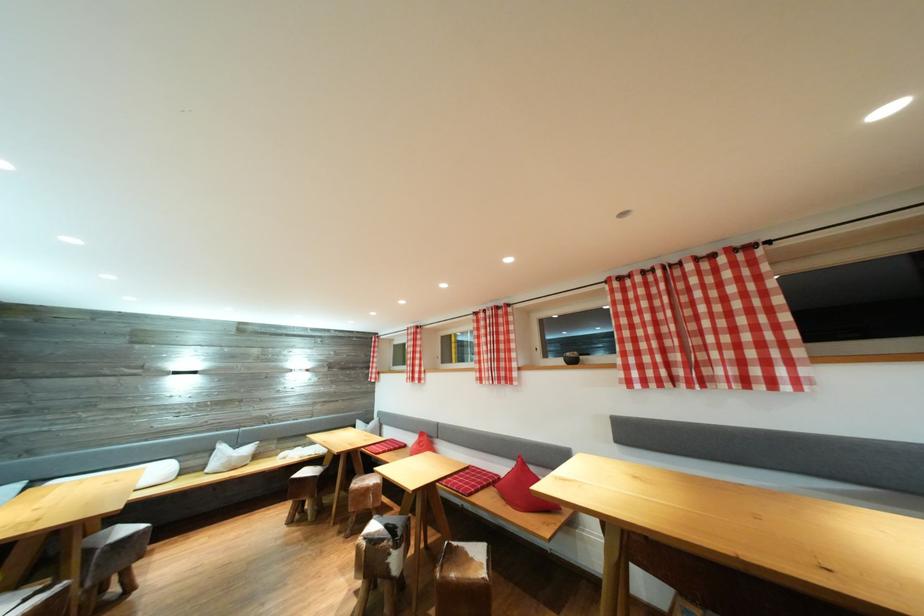
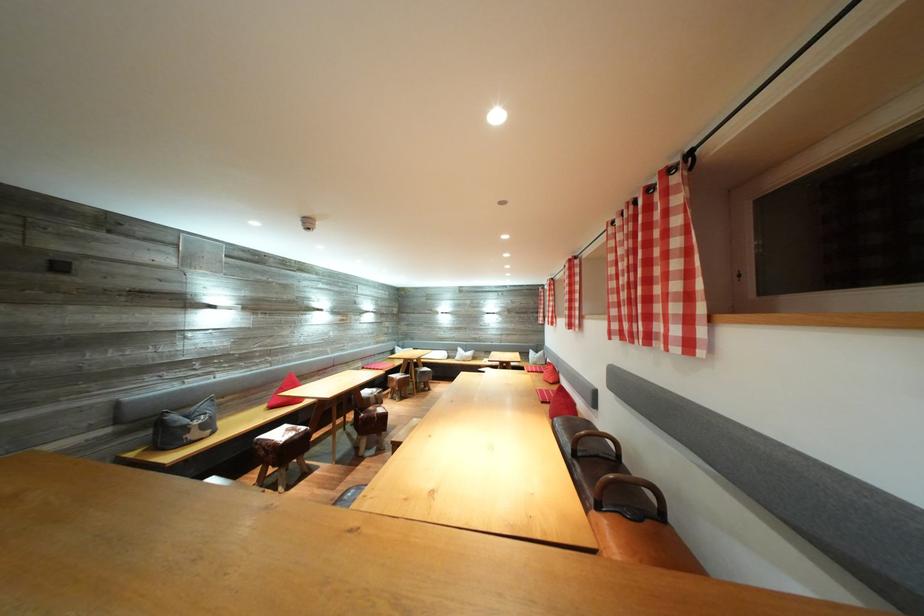
Question: I am providing you with two images of the same scene from different viewpoints. Which of the following objects are not visible in image2?

Choices:
 (A) patterned throw pillow
 (B) white throw pillow
 (C) sofa sitting surface
 (D) none of these

Answer: (D)